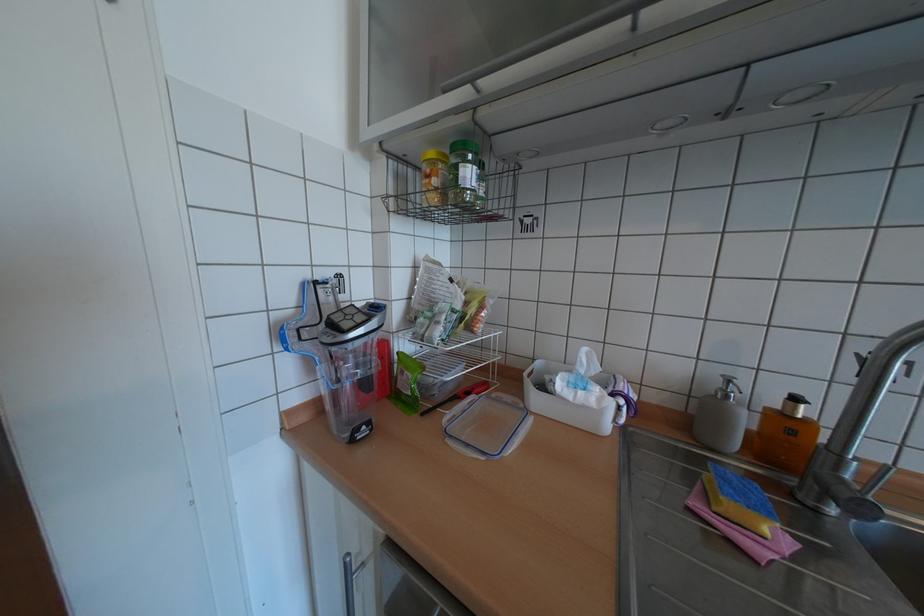
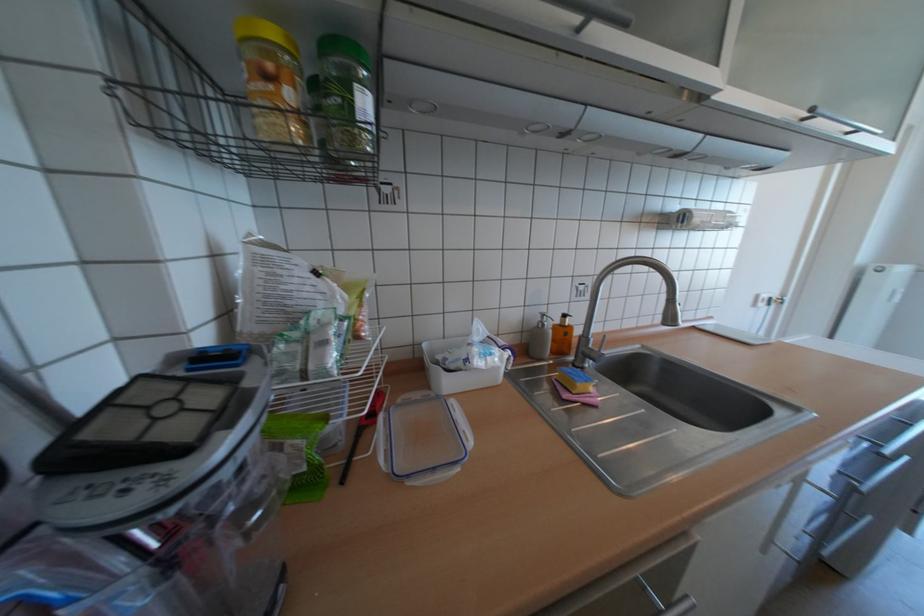
Question: The first image is from the beginning of the video and the second image is from the end. How did the camera likely rotate when shooting the video?

Choices:
 (A) Left
 (B) Right
 (C) Up
 (D) Down

Answer: (B)